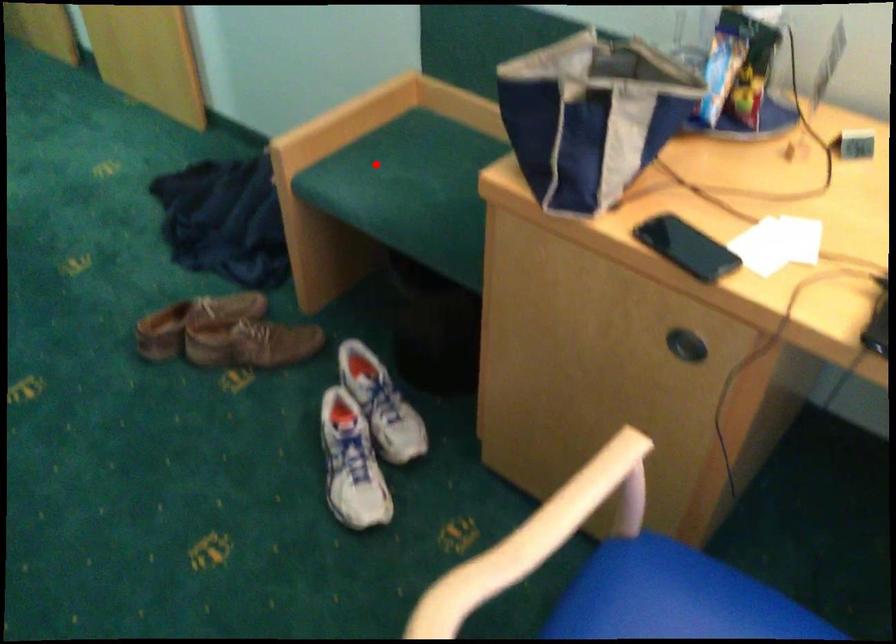
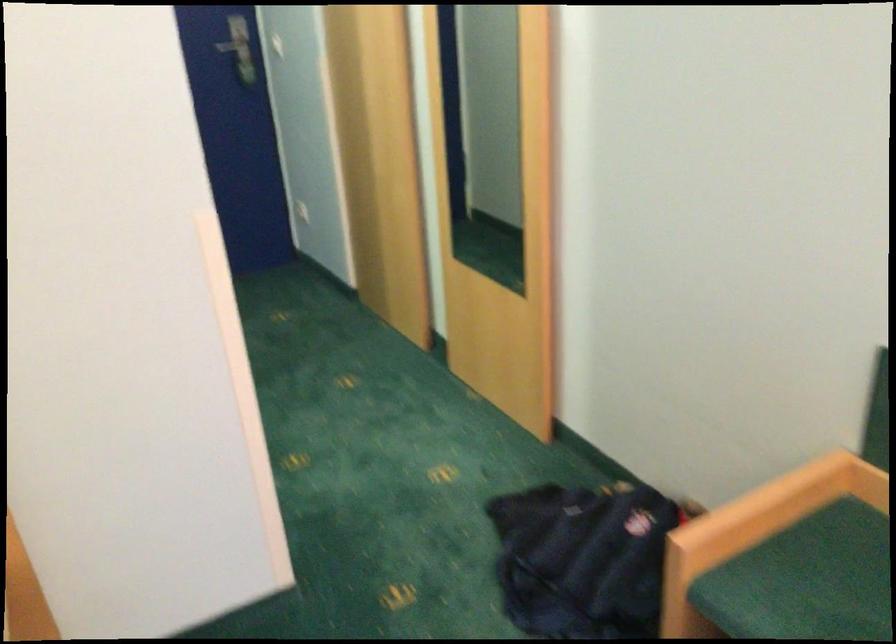
In the second image, find the point that corresponds to the highlighted location in the first image.

(806, 580)